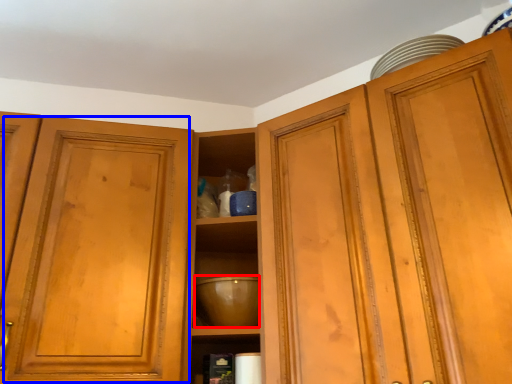
Question: Which object is further to the camera taking this photo, mixing bowl (highlighted by a red box) or glass door (highlighted by a blue box)?

Choices:
 (A) mixing bowl
 (B) glass door

Answer: (A)